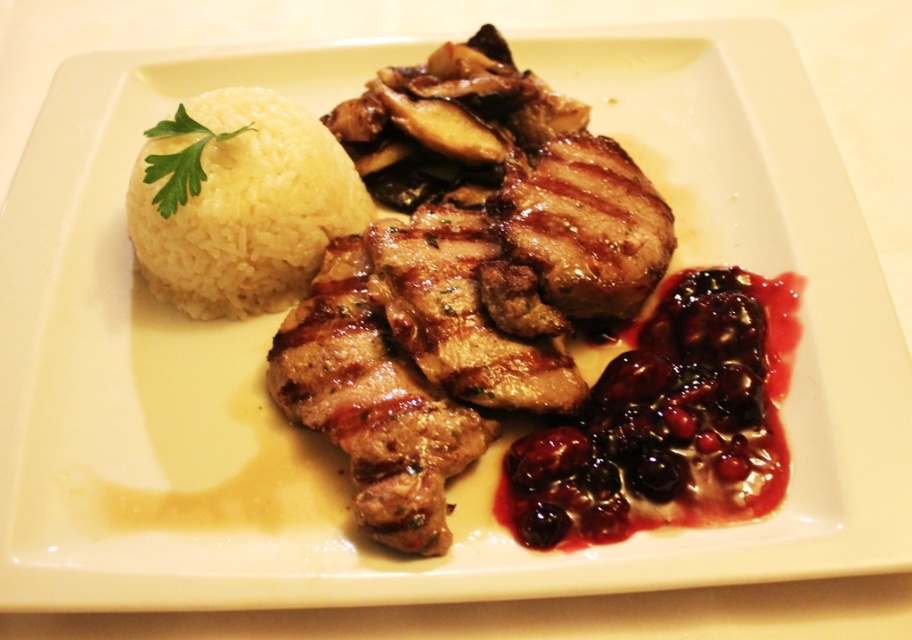
You are a food stylist arranging this meal. You need to place a garnish between the white polished rice at upper left and the green leafy parsley at upper left. Where should you place it to ensure it sits between them?

The white polished rice at upper left is positioned under the green leafy parsley at upper left, so placing the garnish between them would require placing it on top of the rice and below the parsley.

Looking at the plate, where is the savory berry sauce at lower right in relation to the green leafy parsley at upper left?

The savory berry sauce at lower right is to the right of the green leafy parsley at upper left.

You are a food critic who needs to taste both the grilled meat at center and the white polished rice at upper left. If your fork can reach 8 inches, can you reach both items without moving the fork?

The grilled meat at center and white polished rice at upper left are 9.32 inches apart from each other. Since your fork can only reach 8 inches, you cannot reach both items without moving the fork.